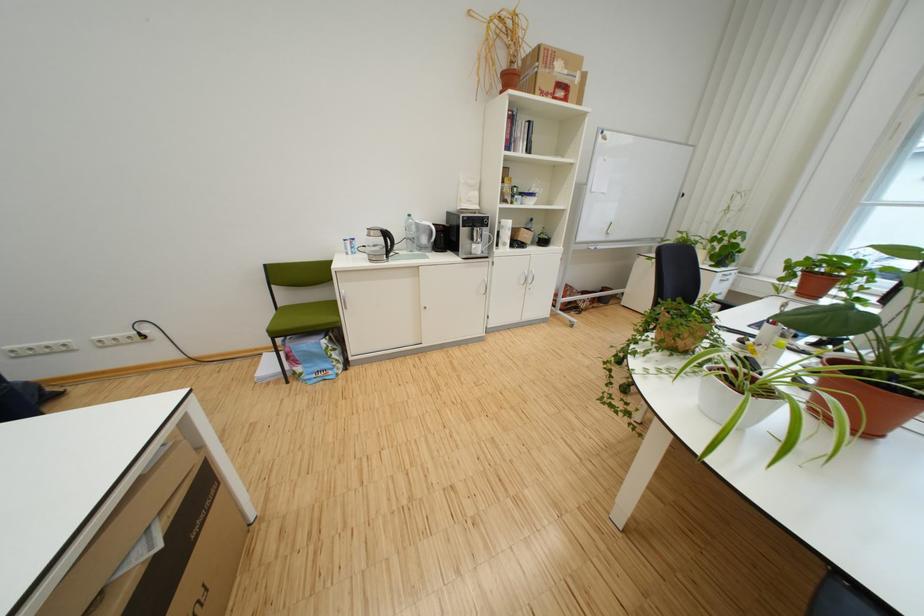
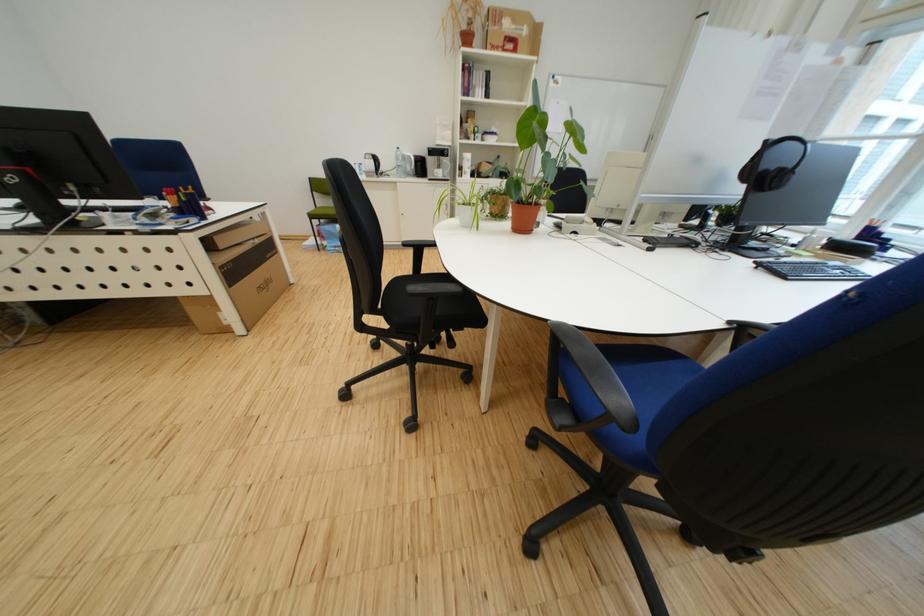
Locate, in the second image, the point that corresponds to the point at 430,227 in the first image.

(417, 159)